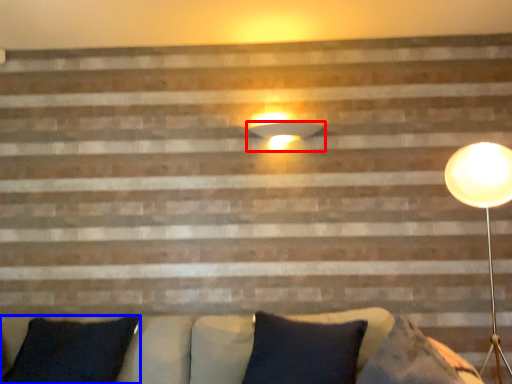
Question: Which point is further to the camera, lamp (highlighted by a red box) or pillow (highlighted by a blue box)?

Choices:
 (A) lamp
 (B) pillow

Answer: (A)